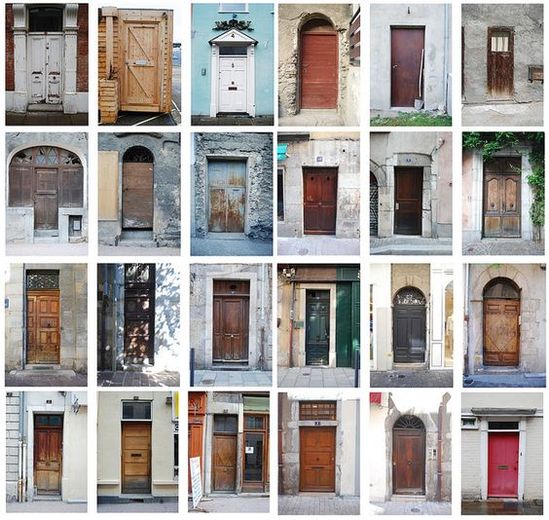
Find the location of a particular element. The width and height of the screenshot is (549, 520). fiberglass-appearing doors is located at coordinates (318, 318), (507, 457), (412, 329), (236, 74).